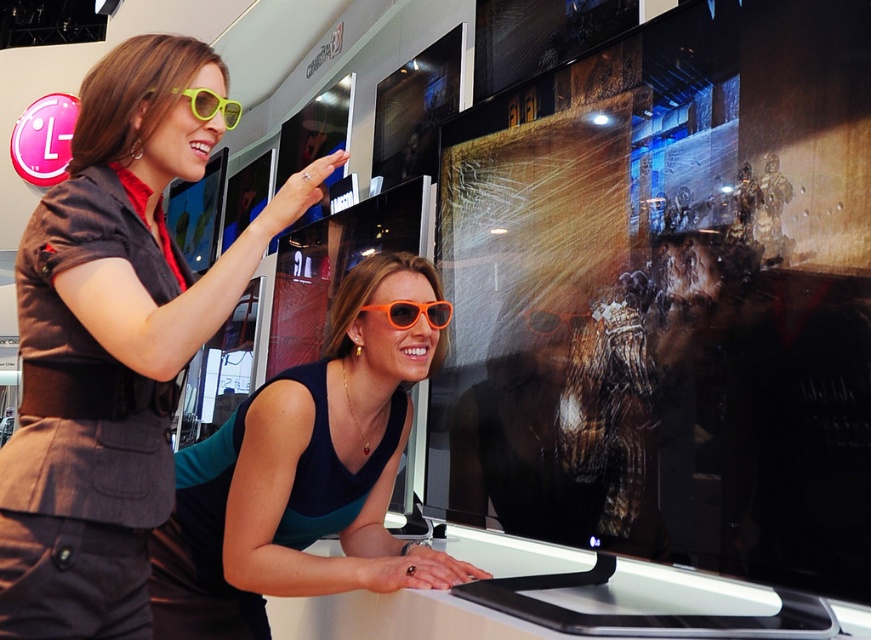
You are a photographer at the exhibition and want to take a photo of the matte black jacket at upper left and the camera. You need to ensure they are both in focus. Given that your camera has a depth of field that can cover objects within 36 inches of each other, will both objects be in focus?

The matte black jacket at upper left and camera are 36.62 inches apart from each other. Since the distance between them exceeds the 36 inches coverage of your camera, they might not both be in focus.

You are a salesperson at an eyewear store. A customer asks if the orange plastic sunglasses at center are thicker or thinner than the yellow matte sunglasses at upper left. Based on the scene, how would you respond?

The orange plastic sunglasses at center are thinner than the yellow matte sunglasses at upper left.

You are a salesperson at an electronics store and need to place two sunglasses samples on a display table. The orange plastic sunglasses at center and yellow matte sunglasses at upper left must be exactly 20 inches apart. Based on the image provided, will you need to move either pair to meet the requirement?

The orange plastic sunglasses at center and yellow matte sunglasses at upper left are currently 19.97 inches apart. Since this is slightly less than the required 20 inches, you would need to move one or both pairs slightly apart to achieve the exact distance.